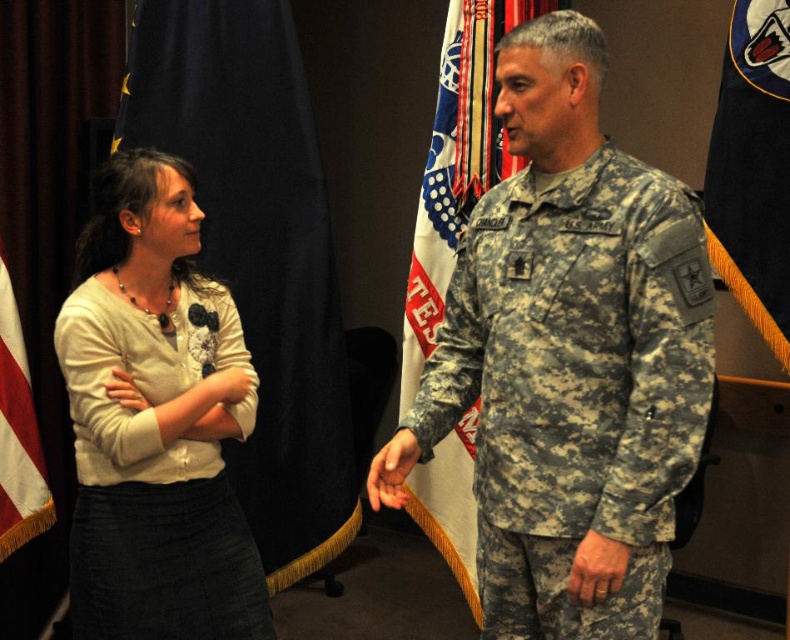
Question: Among these objects, which one is farthest from the camera?

Choices:
 (A) dark blue fabric flag at right
 (B) red-white striped flag at left
 (C) blue fabric flag at left
 (D) white fabric flag at center

Answer: (C)

Question: Which point is closer to the camera taking this photo?

Choices:
 (A) (66, 321)
 (B) (283, 164)

Answer: (A)

Question: Observing the image, what is the correct spatial positioning of white fabric flag at center in reference to dark blue fabric flag at right?

Choices:
 (A) below
 (B) above

Answer: (A)

Question: Which of the following is the farthest from the observer?

Choices:
 (A) camouflage uniform at center
 (B) blue fabric flag at left

Answer: (B)

Question: Where is dark blue fabric flag at right located in relation to red-white striped flag at left in the image?

Choices:
 (A) below
 (B) above

Answer: (B)

Question: Can you confirm if blue fabric flag at left is positioned to the right of white fabric flag at center?

Choices:
 (A) no
 (B) yes

Answer: (A)